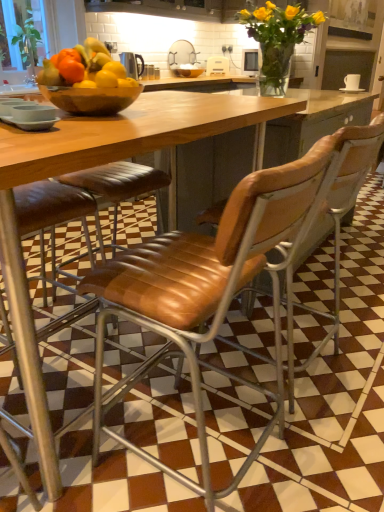
Question: Can you confirm if transparent glass bowl at center is smaller than yellow glass vase at upper center, the 1th flower viewed from the front?

Choices:
 (A) no
 (B) yes

Answer: (B)

Question: Is transparent glass bowl at center closer to the viewer compared to yellow glass vase at upper center, the 1th flower viewed from the front?

Choices:
 (A) no
 (B) yes

Answer: (A)

Question: Can you confirm if transparent glass bowl at center is shorter than yellow glass vase at upper center, which is the second flower in top-to-bottom order?

Choices:
 (A) no
 (B) yes

Answer: (B)

Question: Would you consider transparent glass bowl at center to be distant from yellow glass vase at upper center, which is the second flower in top-to-bottom order?

Choices:
 (A) yes
 (B) no

Answer: (A)

Question: Does transparent glass bowl at center have a larger size compared to yellow glass vase at upper center, arranged as the first flower when ordered from the bottom?

Choices:
 (A) yes
 (B) no

Answer: (B)

Question: Is transparent glass bowl at center oriented away from yellow glass vase at upper center, which ranks as the second flower in back-to-front order?

Choices:
 (A) no
 (B) yes

Answer: (A)

Question: Is yellow matte vase at upper center, positioned as the 2th flower in front-to-back order, closer to the viewer compared to metallic silver kettle at center?

Choices:
 (A) no
 (B) yes

Answer: (A)

Question: Is yellow matte vase at upper center, the 1th flower in the back-to-front sequence, taller than metallic silver kettle at center?

Choices:
 (A) no
 (B) yes

Answer: (B)

Question: From a real-world perspective, does yellow matte vase at upper center, which is the 2th flower in bottom-to-top order, stand above metallic silver kettle at center?

Choices:
 (A) yes
 (B) no

Answer: (A)

Question: Is yellow matte vase at upper center, placed as the 1th flower when sorted from top to bottom, far from metallic silver kettle at center?

Choices:
 (A) yes
 (B) no

Answer: (A)

Question: From a real-world perspective, is yellow matte vase at upper center, positioned as the 2th flower in front-to-back order, physically below metallic silver kettle at center?

Choices:
 (A) yes
 (B) no

Answer: (B)

Question: From the image's perspective, is yellow matte vase at upper center, placed as the 1th flower when sorted from top to bottom, under metallic silver kettle at center?

Choices:
 (A) no
 (B) yes

Answer: (A)

Question: Is wooden bowl at center outside of metallic silver kettle at center?

Choices:
 (A) no
 (B) yes

Answer: (B)